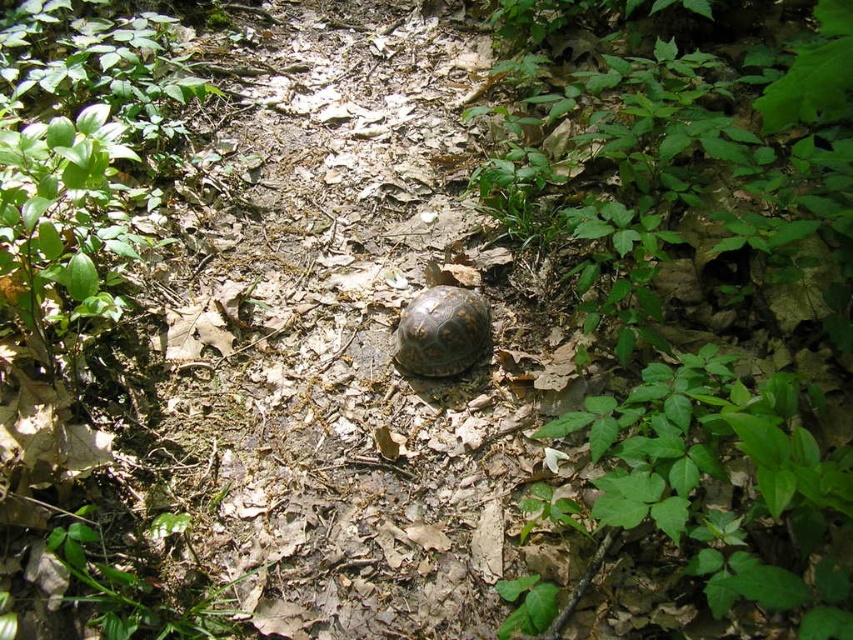
Does green leafy plant at center have a lesser height compared to brown textured tortoise at center?

No.

Who is more distant from viewer, (807, 102) or (457, 307)?

Point (457, 307)

The width and height of the screenshot is (853, 640). I want to click on green leafy plant at center, so 711,179.